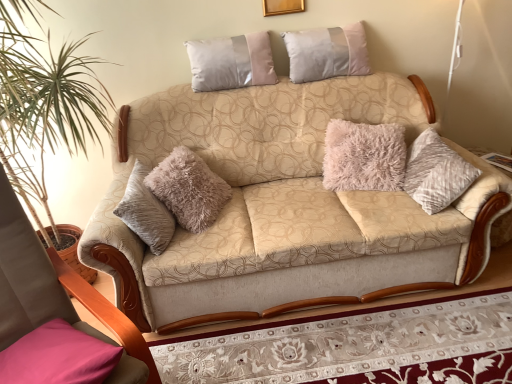
Question: Is beige fabric couch at center behind pink fabric pillow at lower left, which is the 3th pillow from back to front?

Choices:
 (A) no
 (B) yes

Answer: (B)

Question: Can you confirm if beige fabric couch at center is bigger than pink fabric pillow at lower left, the 1th pillow viewed from the front?

Choices:
 (A) no
 (B) yes

Answer: (B)

Question: Would you say beige fabric couch at center is a long distance from pink fabric pillow at lower left, which is the 3th pillow from back to front?

Choices:
 (A) no
 (B) yes

Answer: (A)

Question: Is pink fabric pillow at lower left, the 1th pillow viewed from the front, located within beige fabric couch at center?

Choices:
 (A) no
 (B) yes

Answer: (A)

Question: From the image's perspective, is beige fabric couch at center on top of pink fabric pillow at lower left, which appears as the third pillow when viewed from the right?

Choices:
 (A) no
 (B) yes

Answer: (B)

Question: Considering the relative positions of satin-like beige pillow at upper center, the second pillow viewed from the left, and silky silver pillow at upper center, which is the third pillow from left to right, in the image provided, is satin-like beige pillow at upper center, the second pillow viewed from the left, to the left or to the right of silky silver pillow at upper center, which is the third pillow from left to right,?

Choices:
 (A) right
 (B) left

Answer: (B)

Question: From a real-world perspective, relative to silky silver pillow at upper center, the 1th pillow positioned from the right, is satin-like beige pillow at upper center, placed as the second pillow when sorted from front to back, vertically above or below?

Choices:
 (A) below
 (B) above

Answer: (B)

Question: Is satin-like beige pillow at upper center, which is the second pillow in bottom-to-top order, in front of or behind silky silver pillow at upper center, arranged as the 3th pillow when viewed from the front, in the image?

Choices:
 (A) behind
 (B) front

Answer: (B)

Question: In terms of width, does satin-like beige pillow at upper center, the second pillow viewed from the left, look wider or thinner when compared to silky silver pillow at upper center, the 1th pillow positioned from the right?

Choices:
 (A) thin
 (B) wide

Answer: (A)

Question: Does point (208, 77) appear closer or farther from the camera than point (224, 276)?

Choices:
 (A) closer
 (B) farther

Answer: (B)

Question: From the image's perspective, relative to beige fabric couch at center, is satin-like beige pillow at upper center, the second pillow viewed from the left, above or below?

Choices:
 (A) below
 (B) above

Answer: (B)

Question: Is satin-like beige pillow at upper center, placed as the second pillow when sorted from front to back, taller or shorter than beige fabric couch at center?

Choices:
 (A) tall
 (B) short

Answer: (B)

Question: Relative to beige fabric couch at center, is satin-like beige pillow at upper center, the second pillow viewed from the left, in front or behind?

Choices:
 (A) behind
 (B) front

Answer: (A)

Question: Would you say gold wooden picture frame at upper center is inside or outside pink fabric pillow at lower left, which ranks as the 3th pillow in top-to-bottom order?

Choices:
 (A) outside
 (B) inside

Answer: (A)

Question: From the image's perspective, relative to pink fabric pillow at lower left, arranged as the 1th pillow when ordered from the bottom, is gold wooden picture frame at upper center above or below?

Choices:
 (A) above
 (B) below

Answer: (A)